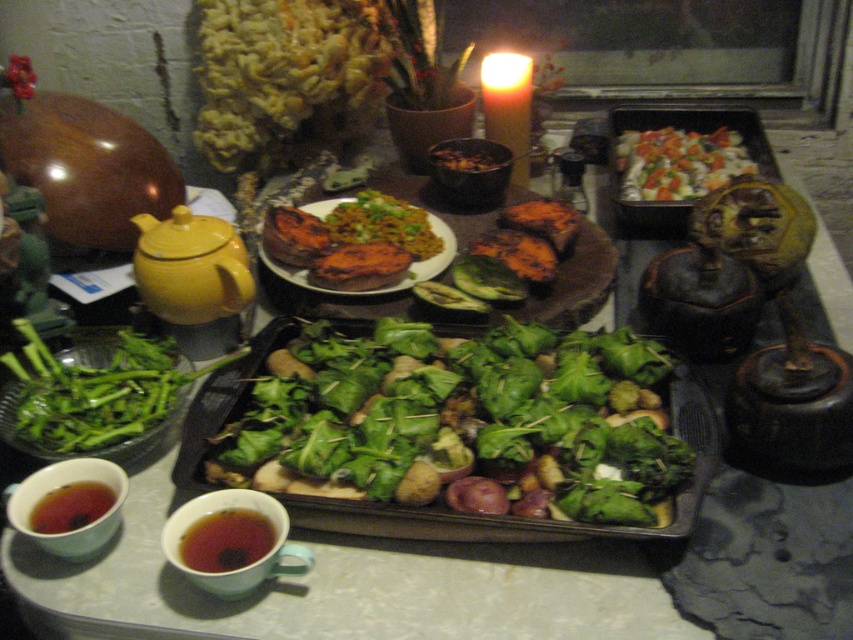
You are a guest at the table and want to reach for the grilled sweet potato at center. Which direction should you move your hand from the green leafy vegetable at lower left to get it?

You should move your hand to the right from the green leafy vegetable at lower left to reach the grilled sweet potato at center, since the green leafy vegetable at lower left is to the left of grilled sweet potato at center.